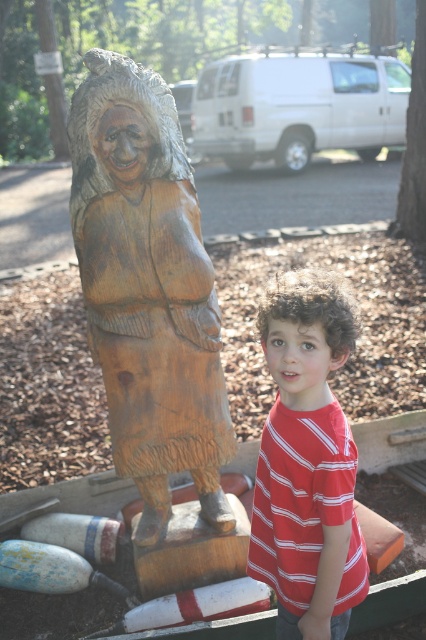
Question: Among these points, which one is farthest from the camera?

Choices:
 (A) (193, 310)
 (B) (288, 592)

Answer: (A)

Question: Can you confirm if wooden carving at left is positioned to the left of red striped shirt at center?

Choices:
 (A) yes
 (B) no

Answer: (A)

Question: Which of the following is the closest to the observer?

Choices:
 (A) red striped shirt at center
 (B) wooden carving at left

Answer: (A)

Question: Is wooden carving at left above red striped shirt at center?

Choices:
 (A) yes
 (B) no

Answer: (A)

Question: Is wooden carving at left to the left of red striped shirt at center from the viewer's perspective?

Choices:
 (A) no
 (B) yes

Answer: (B)